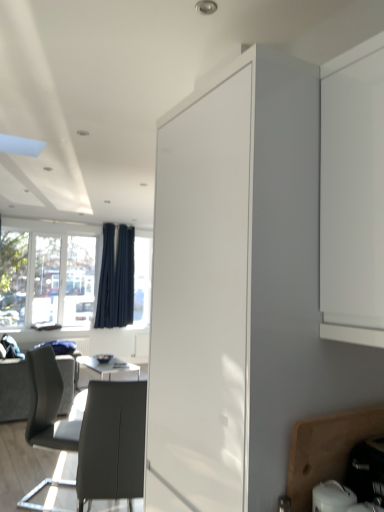
The height and width of the screenshot is (512, 384). Find the location of `empty space that is ontop of wooden cutting board at lower right, which is the first cabinetry from bottom to top`. empty space that is ontop of wooden cutting board at lower right, which is the first cabinetry from bottom to top is located at coordinates (340, 395).